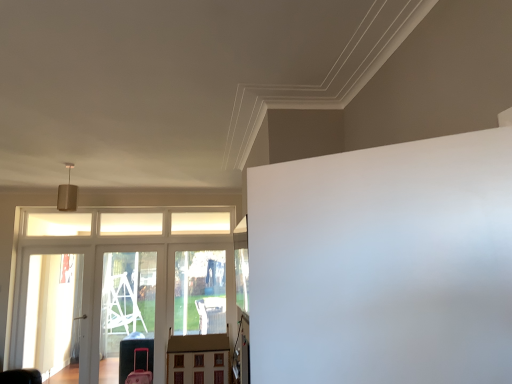
Question: From a real-world perspective, is transparent plastic screen door at left, which is the second screen door from left to right, under transparent glass screen door at left, the 2th screen door in the right-to-left sequence?

Choices:
 (A) yes
 (B) no

Answer: (A)

Question: Is transparent plastic screen door at left, which is the second screen door from left to right, next to transparent glass screen door at left, which is counted as the first screen door, starting from the left?

Choices:
 (A) yes
 (B) no

Answer: (B)

Question: Considering the relative sizes of transparent plastic screen door at left, which ranks as the first screen door in right-to-left order, and transparent glass screen door at left, the 2th screen door in the right-to-left sequence, in the image provided, is transparent plastic screen door at left, which ranks as the first screen door in right-to-left order, thinner than transparent glass screen door at left, the 2th screen door in the right-to-left sequence,?

Choices:
 (A) yes
 (B) no

Answer: (B)

Question: Does transparent plastic screen door at left, which ranks as the first screen door in right-to-left order, have a smaller size compared to transparent glass screen door at left, the 2th screen door in the right-to-left sequence?

Choices:
 (A) yes
 (B) no

Answer: (B)

Question: From the image's perspective, would you say transparent plastic screen door at left, which ranks as the first screen door in right-to-left order, is shown under transparent glass screen door at left, which is counted as the first screen door, starting from the left?

Choices:
 (A) no
 (B) yes

Answer: (B)

Question: From a real-world perspective, is wooden dollhouse at center positioned above or below transparent plastic screen door at left, which ranks as the first screen door in right-to-left order?

Choices:
 (A) below
 (B) above

Answer: (A)

Question: Considering the positions of wooden dollhouse at center and transparent plastic screen door at left, which is the second screen door from left to right, in the image, is wooden dollhouse at center wider or thinner than transparent plastic screen door at left, which is the second screen door from left to right,?

Choices:
 (A) thin
 (B) wide

Answer: (B)

Question: From the image's perspective, is wooden dollhouse at center positioned above or below transparent plastic screen door at left, which is the second screen door from left to right?

Choices:
 (A) above
 (B) below

Answer: (B)

Question: Considering the positions of point (205, 336) and point (119, 319), is point (205, 336) closer or farther from the camera than point (119, 319)?

Choices:
 (A) farther
 (B) closer

Answer: (B)

Question: Is transparent glass screen door at left, which is counted as the first screen door, starting from the left, bigger or smaller than wooden dollhouse at center?

Choices:
 (A) small
 (B) big

Answer: (A)

Question: Relative to wooden dollhouse at center, is transparent glass screen door at left, which is counted as the first screen door, starting from the left, in front or behind?

Choices:
 (A) front
 (B) behind

Answer: (B)

Question: From the image's perspective, relative to wooden dollhouse at center, is transparent glass screen door at left, which is counted as the first screen door, starting from the left, above or below?

Choices:
 (A) below
 (B) above

Answer: (B)

Question: Considering the positions of transparent glass screen door at left, which is counted as the first screen door, starting from the left, and wooden dollhouse at center in the image, is transparent glass screen door at left, which is counted as the first screen door, starting from the left, taller or shorter than wooden dollhouse at center?

Choices:
 (A) tall
 (B) short

Answer: (A)

Question: Looking at their shapes, would you say transparent plastic elevator at lower left is wider or thinner than transparent glass screen door at left, which is counted as the first screen door, starting from the left?

Choices:
 (A) thin
 (B) wide

Answer: (A)

Question: In the image, is transparent plastic elevator at lower left on the left side or the right side of transparent glass screen door at left, the 2th screen door in the right-to-left sequence?

Choices:
 (A) left
 (B) right

Answer: (B)